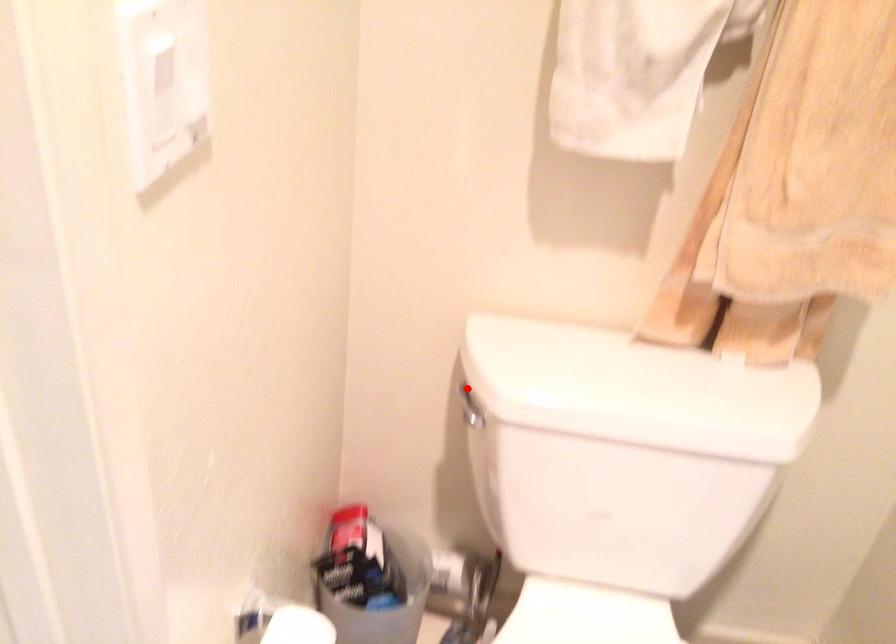
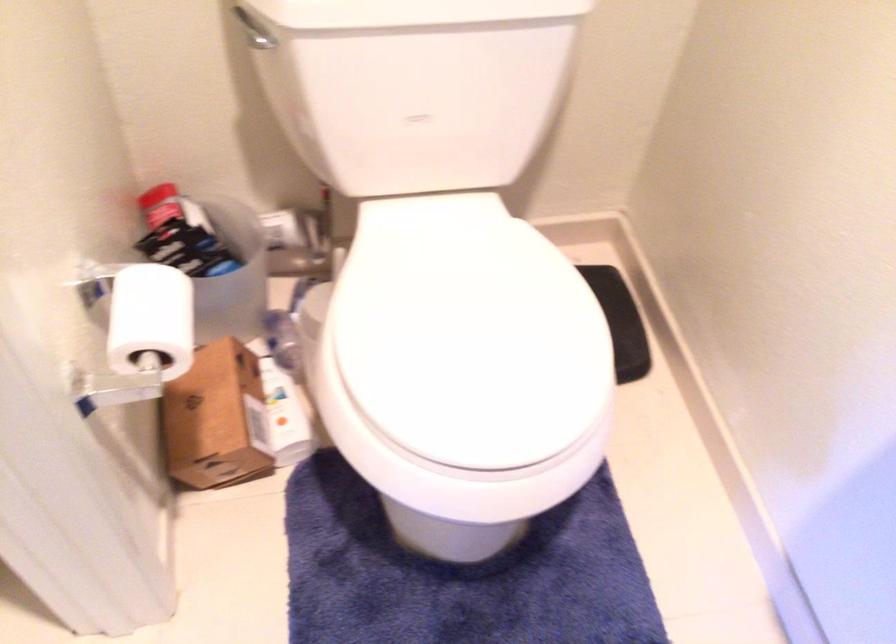
Where in the second image is the point corresponding to the highlighted location from the first image?

(247, 20)